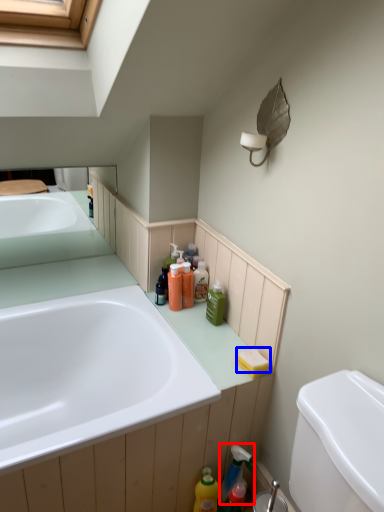
Question: Among these objects, which one is farthest to the camera, cleaning product (highlighted by a red box) or soap (highlighted by a blue box)?

Choices:
 (A) cleaning product
 (B) soap

Answer: (A)